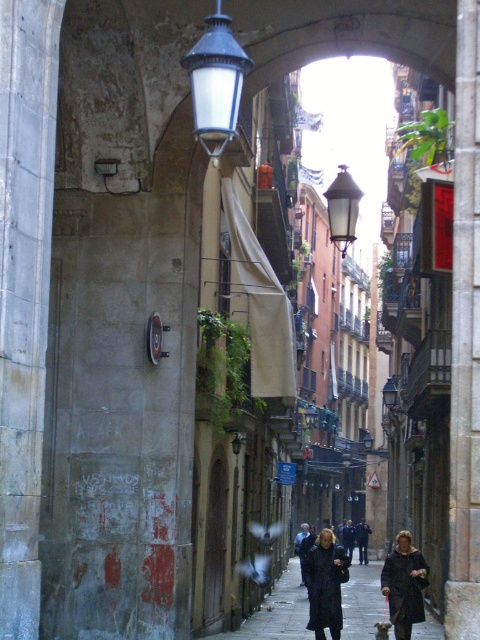
Question: Which is nearer to the matte glass lamp at upper center?

Choices:
 (A) matte black streetlamp at upper center
 (B) dark gray coat at lower right
 (C) smooth asphalt sidewalk at center

Answer: (A)

Question: Which object is positioned closest to the dark brown leather coat at center?

Choices:
 (A) matte black streetlamp at upper center
 (B) smooth asphalt sidewalk at center
 (C) matte glass lamp at upper center
 (D) dark gray coat at lower right

Answer: (D)

Question: Does matte glass lamp at upper center appear on the left side of dark gray coat at lower right?

Choices:
 (A) no
 (B) yes

Answer: (B)

Question: Is dark brown leather coat at center bigger than dark gray coat at lower right?

Choices:
 (A) yes
 (B) no

Answer: (B)

Question: Is smooth asphalt sidewalk at center closer to camera compared to matte glass lamp at upper center?

Choices:
 (A) no
 (B) yes

Answer: (A)

Question: Among these points, which one is nearest to the camera?

Choices:
 (A) (229, 113)
 (B) (427, 564)

Answer: (A)